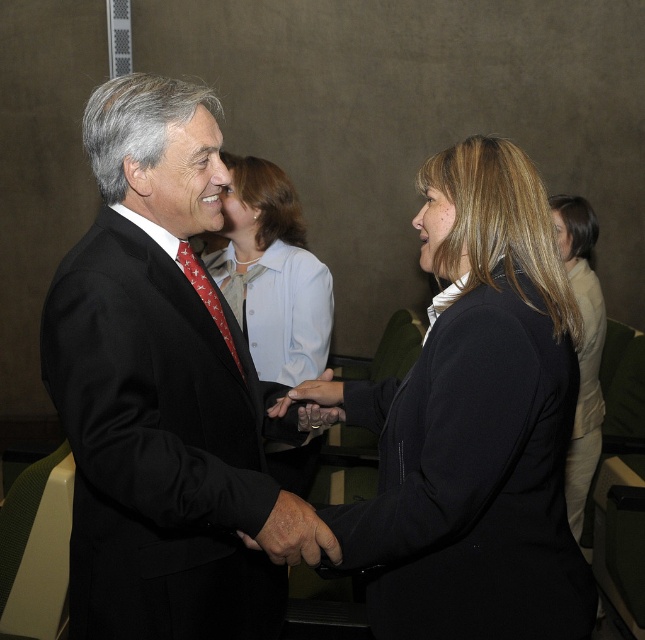
Question: Which point is farther from the camera taking this photo?

Choices:
 (A) (224, 336)
 (B) (433, 627)
 (C) (259, 547)

Answer: (A)

Question: Which point appears closest to the camera in this image?

Choices:
 (A) (195, 285)
 (B) (333, 416)
 (C) (312, 518)

Answer: (C)

Question: Which object is closer to the camera taking this photo?

Choices:
 (A) black matte jacket at center
 (B) light blue shirt at center
 (C) leather-like skin at center

Answer: (A)

Question: Does black suit at center appear over light blue shirt at center?

Choices:
 (A) yes
 (B) no

Answer: (B)

Question: Does light blue shirt at center lie in front of red silk tie at center?

Choices:
 (A) no
 (B) yes

Answer: (A)

Question: Does black matte jacket at center have a lesser width compared to leather-like skin at center?

Choices:
 (A) no
 (B) yes

Answer: (A)